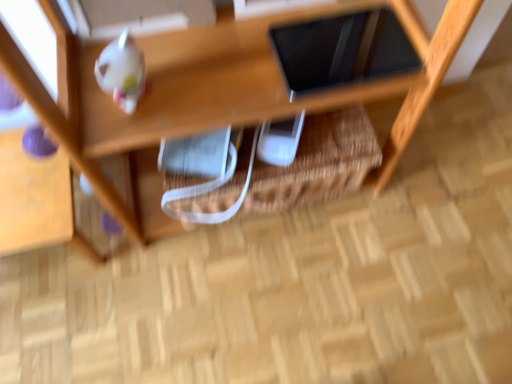
Question: Should I look upward or downward to see white glossy teapot at upper left?

Choices:
 (A) down
 (B) up

Answer: (B)

Question: Is woven straw basket at center smaller than wooden shelf at upper center?

Choices:
 (A) yes
 (B) no

Answer: (B)

Question: From the image's perspective, would you say woven straw basket at center is positioned over wooden shelf at upper center?

Choices:
 (A) no
 (B) yes

Answer: (B)

Question: Is woven straw basket at center closer to the viewer compared to wooden shelf at upper center?

Choices:
 (A) no
 (B) yes

Answer: (A)

Question: Is woven straw basket at center positioned with its back to wooden shelf at upper center?

Choices:
 (A) no
 (B) yes

Answer: (A)

Question: Does woven straw basket at center have a greater width compared to wooden shelf at upper center?

Choices:
 (A) yes
 (B) no

Answer: (B)

Question: Is woven straw basket at center to the left of wooden shelf at upper center from the viewer's perspective?

Choices:
 (A) yes
 (B) no

Answer: (A)

Question: Does wooden shelf at upper center contain woven straw basket at center?

Choices:
 (A) no
 (B) yes

Answer: (A)

Question: Can you confirm if wooden shelf at upper center is smaller than woven straw basket at center?

Choices:
 (A) no
 (B) yes

Answer: (B)

Question: Is wooden shelf at upper center at the left side of woven straw basket at center?

Choices:
 (A) yes
 (B) no

Answer: (B)

Question: Can you confirm if wooden shelf at upper center is thinner than woven straw basket at center?

Choices:
 (A) yes
 (B) no

Answer: (B)

Question: Is wooden shelf at upper center directly adjacent to woven straw basket at center?

Choices:
 (A) no
 (B) yes

Answer: (A)

Question: Is wooden shelf at upper center far from woven straw basket at center?

Choices:
 (A) yes
 (B) no

Answer: (B)

Question: From the image's perspective, is black glossy tablet at upper center under white glossy teapot at upper left?

Choices:
 (A) no
 (B) yes

Answer: (A)